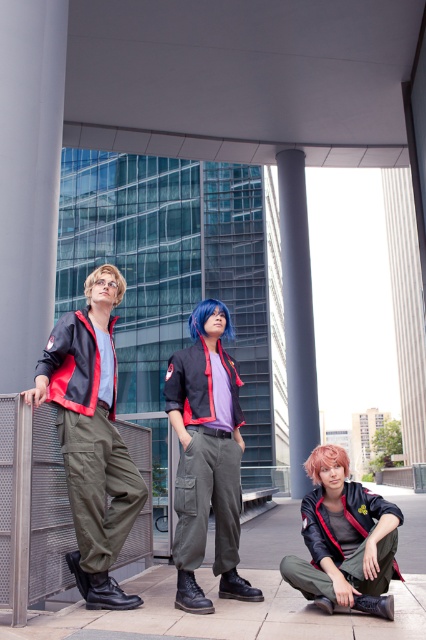
You are a photographer trying to capture a group shot of the three people in the scene. You want to ensure that the matte black jacket at lower right and the blue matte wig at center are both visible in the frame. Based on their positions, which direction should you move the camera to include both objects?

The matte black jacket at lower right is to the right of the blue matte wig at center, so moving the camera slightly to the right will ensure both objects are visible in the frame.

You are a photographer setting up a tripod to capture the scene. You need to ensure that both the pink matte hair at lower center and the blue matte wig at center are fully visible in the frame. Based on their heights, which one might require adjusting the camera angle to avoid being obscured?

The pink matte hair at lower center is taller than the blue matte wig at center, so the camera angle may need to be adjusted to ensure the shorter blue matte wig at center is not obscured by the taller pink matte hair at lower center.

You are standing in front of the modern building and want to locate the matte black jacket at lower right. According to the coordinates provided, where exactly should you look?

You should look at point 0.850 on the x axis and 0.798 on the y axis to find the matte black jacket at lower right.